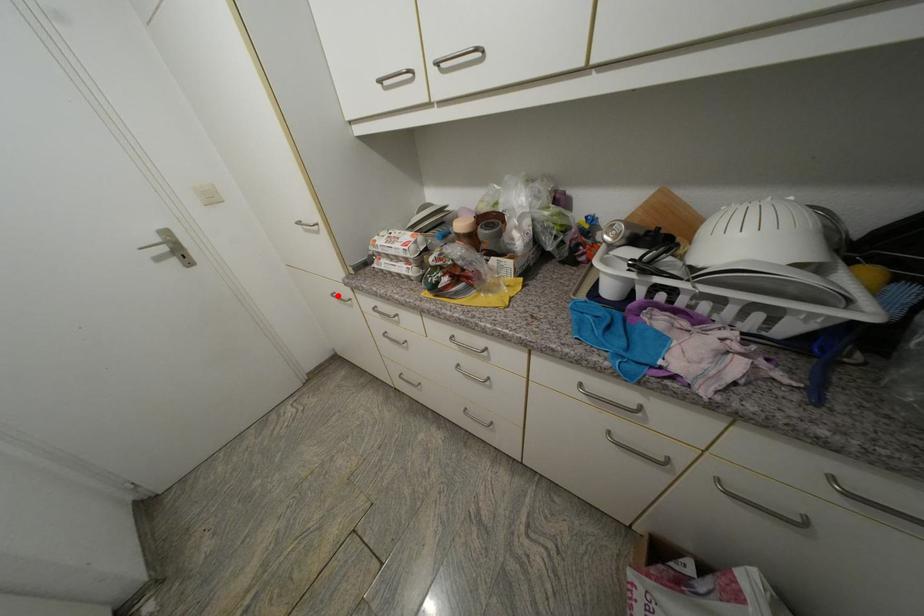
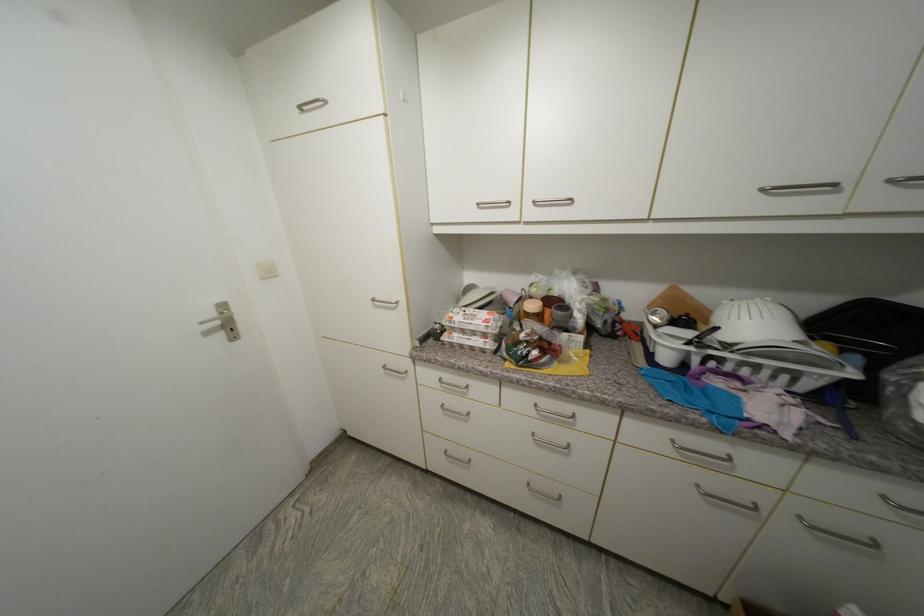
Question: I am providing you with two images of the same scene from different viewpoints. Given a red point in image1, look at the same physical point in image2. Is it:

Choices:
 (A) Closer to the viewpoint
 (B) Farther from the viewpoint

Answer: (B)